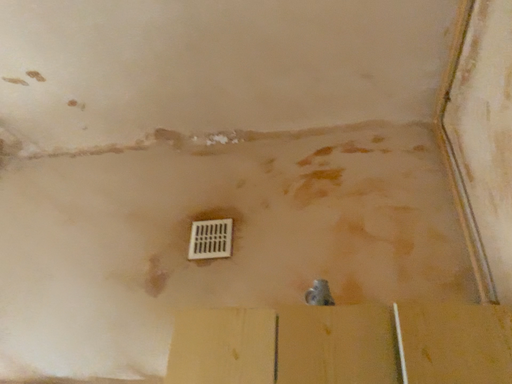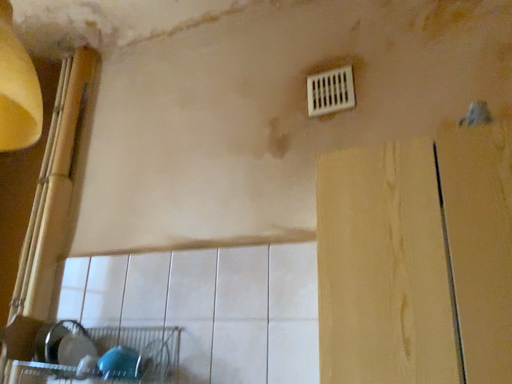
Question: Which way did the camera rotate in the video?

Choices:
 (A) rotated downward
 (B) rotated upward

Answer: (A)